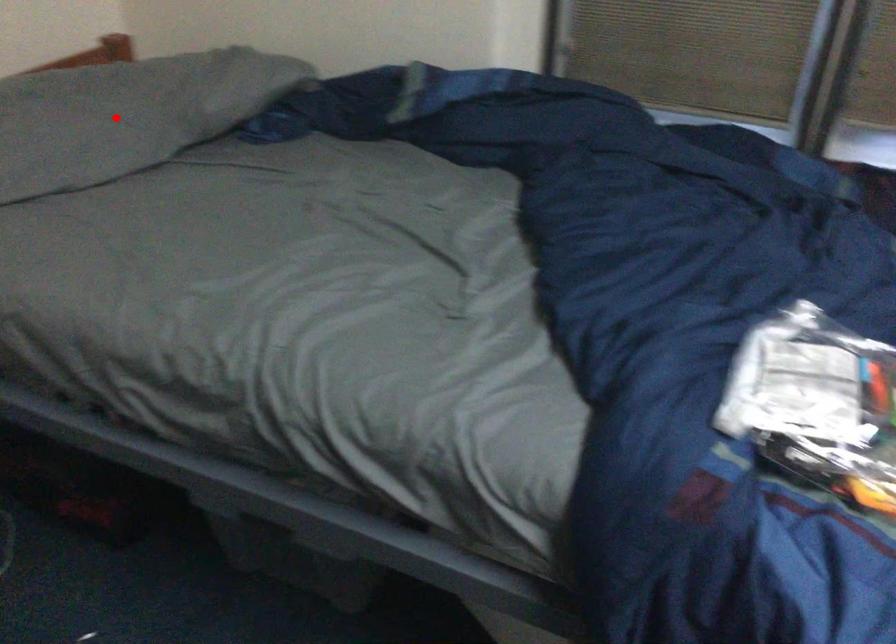
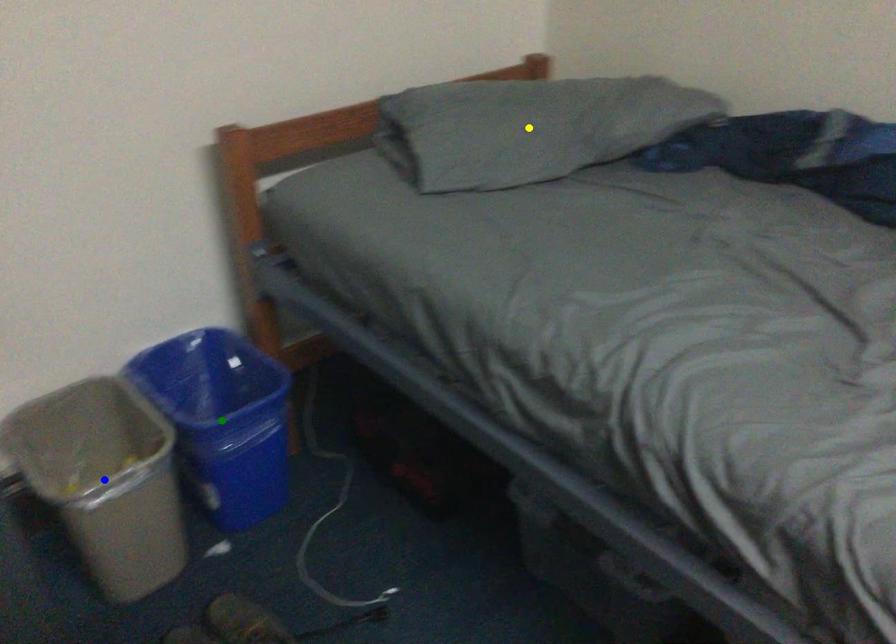
Question: I am providing you with two images of the same scene from different viewpoints. A red point is marked on the first image. You are given multiple points on the second image. Can you choose the point in image 2 that corresponds to the point in image 1?

Choices:
 (A) blue point
 (B) yellow point
 (C) green point

Answer: (B)